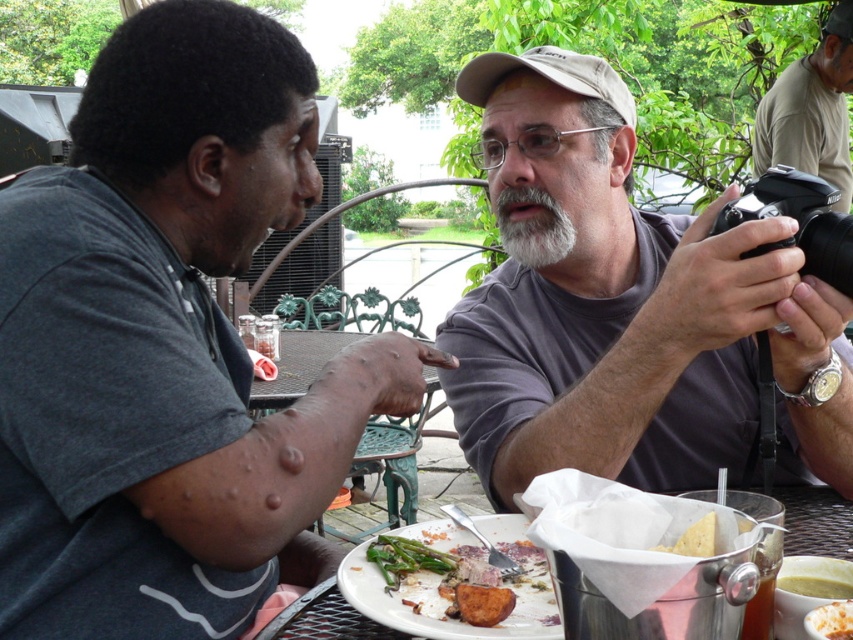
Question: Does gray matte camera at center have a smaller size compared to green asparagus at center?

Choices:
 (A) yes
 (B) no

Answer: (B)

Question: Does green asparagus at center lie behind silver metallic bucket at lower center?

Choices:
 (A) no
 (B) yes

Answer: (A)

Question: Is gray matte camera at center thinner than golden crispy fries at lower right?

Choices:
 (A) yes
 (B) no

Answer: (B)

Question: Which of the following is the closest to the observer?

Choices:
 (A) golden crispy fries at lower right
 (B) khaki cotton shirt at upper right
 (C) gray matte camera at center

Answer: (A)

Question: Which point appears closest to the camera in this image?

Choices:
 (A) (9, 554)
 (B) (496, 600)
 (C) (837, 605)
 (D) (850, 541)

Answer: (C)

Question: Which point is farther to the camera?

Choices:
 (A) khaki cotton shirt at upper right
 (B) golden crispy fries at lower right
 (C) green asparagus at center
 (D) silver metallic bucket at lower center

Answer: (A)